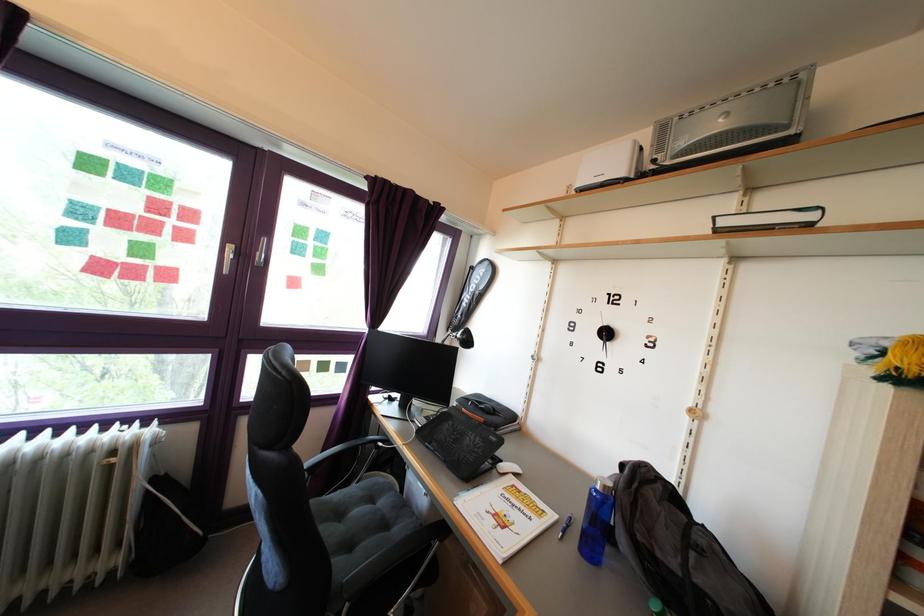
You are a GUI agent. You are given a task and a screenshot of the screen. Output one action in this format:
    pyautogui.click(x=<x>, y=<y>)
    Task: Click on the blue water bottle
    This screenshot has width=924, height=616.
    Given the screenshot: What is the action you would take?
    pyautogui.click(x=596, y=522)